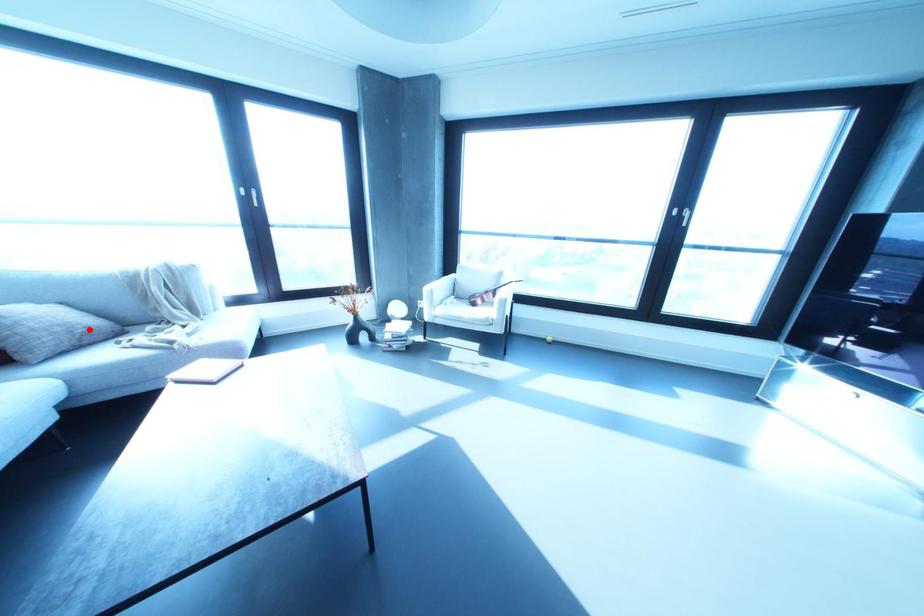
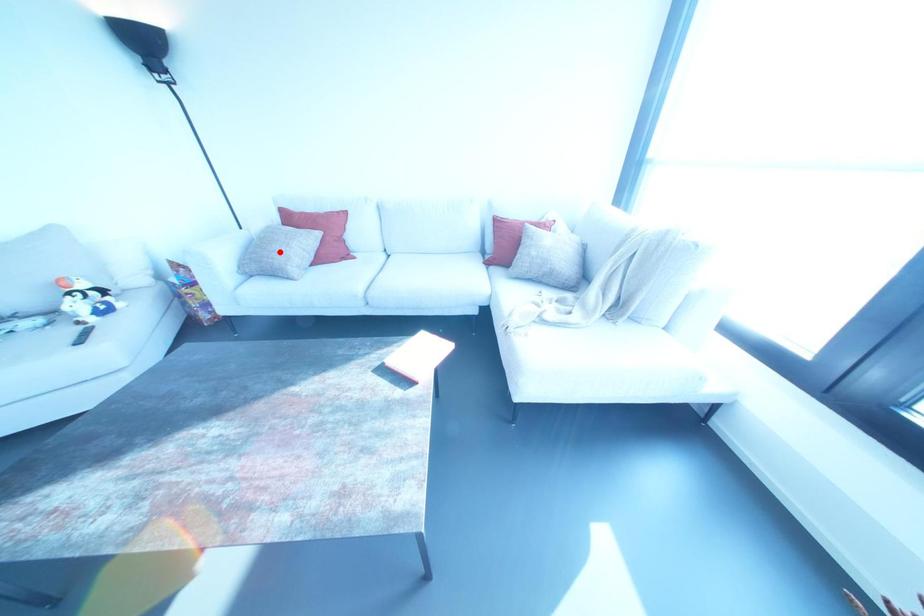
I am providing you with two images of the same scene from different viewpoints. A red point is marked on the first image and another point is marked on the second image. Do the highlighted points in image1 and image2 indicate the same real-world spot?

No